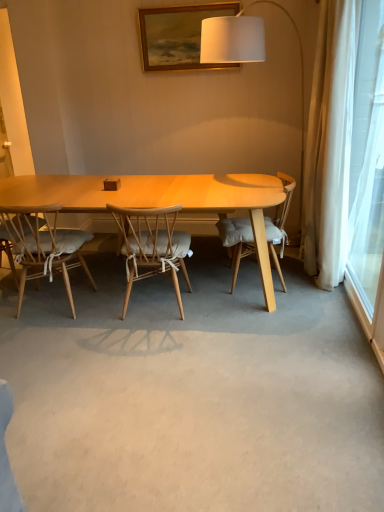
Identify the location of free location in front of white fabric lampshade at upper center. This screenshot has width=384, height=512. (234, 303).